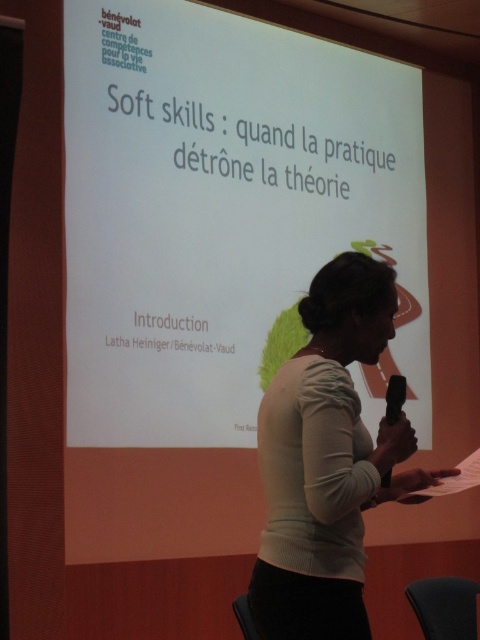
You are an attendee at the presentation. You notice two points in the image. One is at coordinate point (309,116) and the other is at point (283,392). Which point is closer to you?

Point (309,116) is closer to you because it is further to the viewer than point (283,392).

You are an event organizer who needs to ensure that the microphone and papers are within reach of the speaker. Considering the spatial arrangement of the white matte projection screen at upper center and the matte white sweater at center, can you confirm if the speaker has enough space to move freely between them?

The white matte projection screen at upper center is wider than the matte white sweater at center, so the speaker likely has enough space to move freely between them as the screen is positioned above and the sweater is at the center, allowing for lateral movement.